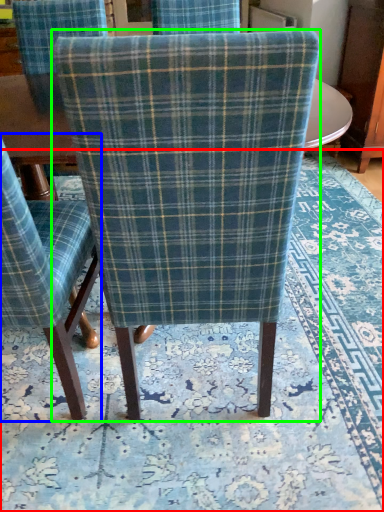
Question: Which object is the farthest from mat (highlighted by a red box)? Choose among these: chair (highlighted by a blue box) or chair (highlighted by a green box).

Choices:
 (A) chair
 (B) chair

Answer: (B)